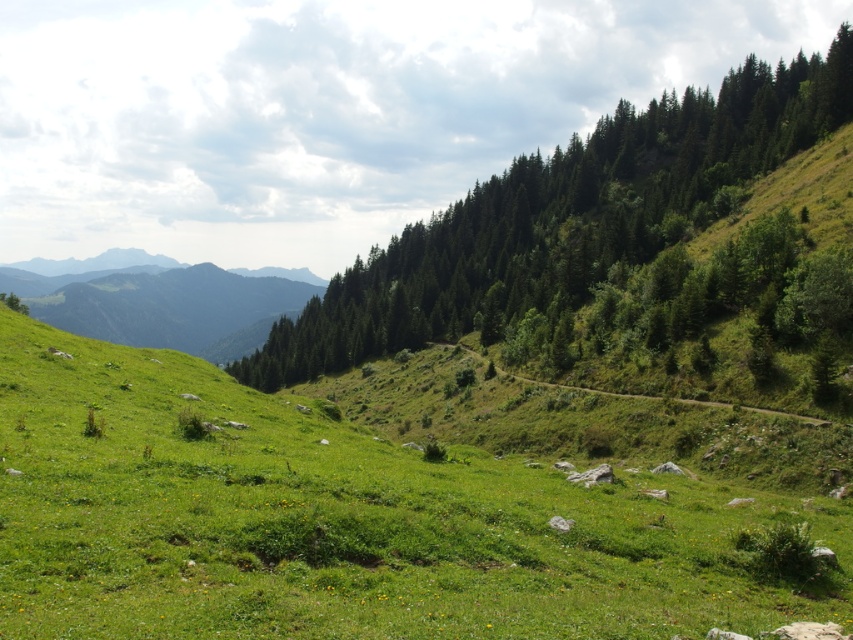
Who is lower down, green grassy at center or green grassy mountain at upper left?

green grassy at center

Who is shorter, green grassy at center or green grassy mountain at upper left?

With less height is green grassy at center.

I want to click on green grassy at center, so click(x=339, y=522).

Is green textured trees at upper right bigger than green grassy mountain at upper left?

Incorrect, green textured trees at upper right is not larger than green grassy mountain at upper left.

Is green textured trees at upper right taller than green grassy mountain at upper left?

No.

Between point (521, 291) and point (260, 268), which one is positioned behind?

The point (260, 268) is more distant.

This screenshot has width=853, height=640. I want to click on green textured trees at upper right, so click(560, 220).

Who is positioned more to the right, green grassy at center or green textured trees at upper right?

Positioned to the right is green textured trees at upper right.

Does green grassy at center have a larger size compared to green textured trees at upper right?

Actually, green grassy at center might be smaller than green textured trees at upper right.

Who is more forward, (138, 566) or (418, 298)?

Point (138, 566)

Where is `green grassy at center`? The image size is (853, 640). green grassy at center is located at coordinates (339, 522).